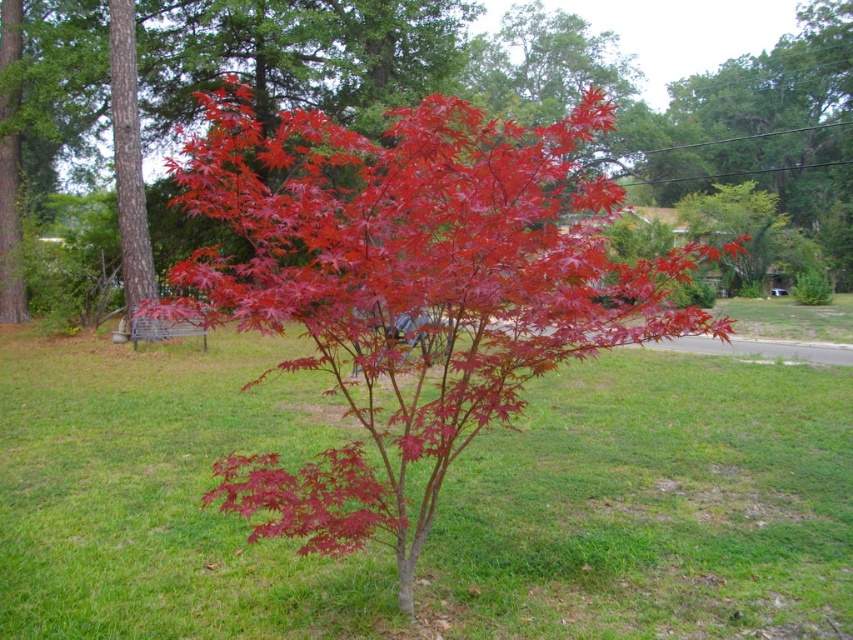
Is point (671, 468) more distant than point (844, 234)?

No, (671, 468) is in front of (844, 234).

Does green grass at center appear under bright red leaves at center?

Yes, green grass at center is below bright red leaves at center.

Between point (761, 381) and point (280, 4), which one is positioned behind?

Point (280, 4)

The width and height of the screenshot is (853, 640). I want to click on green grass at center, so click(x=653, y=508).

Between point (746, 600) and point (254, 477), which one is positioned behind?

The point (746, 600) is behind.

Measure the distance between green grass at center and camera.

green grass at center and camera are 3.00 meters apart from each other.

Find the location of a particular element. This screenshot has width=853, height=640. green grass at center is located at coordinates (653, 508).

Is point (440, 378) in front of point (111, 289)?

That is True.

In the scene shown: Which of these two, glossy red maple at center or bright red leaves at center, stands shorter?

glossy red maple at center

This screenshot has width=853, height=640. Find the location of `glossy red maple at center`. glossy red maple at center is located at coordinates (409, 291).